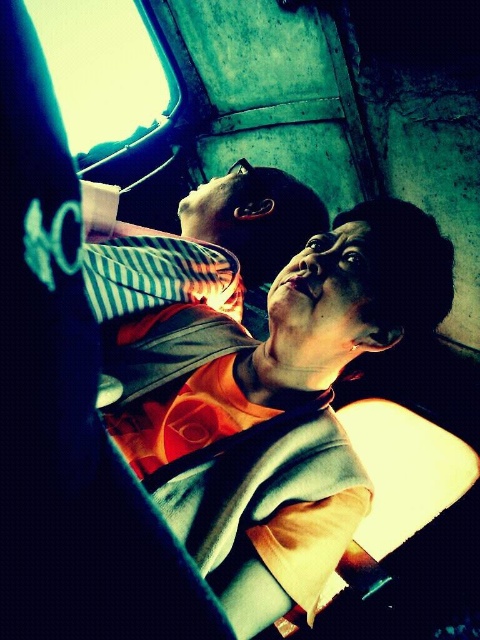
Question: Which object is farther from the camera taking this photo?

Choices:
 (A) striped fabric pillow at upper center
 (B) transparent glass window at upper left

Answer: (A)

Question: Can you confirm if striped fabric pillow at upper center is wider than transparent glass window at upper left?

Choices:
 (A) no
 (B) yes

Answer: (A)

Question: Does striped fabric pillow at upper center appear under transparent glass window at upper left?

Choices:
 (A) no
 (B) yes

Answer: (B)

Question: Can you confirm if striped fabric pillow at upper center is positioned to the right of transparent glass window at upper left?

Choices:
 (A) yes
 (B) no

Answer: (A)